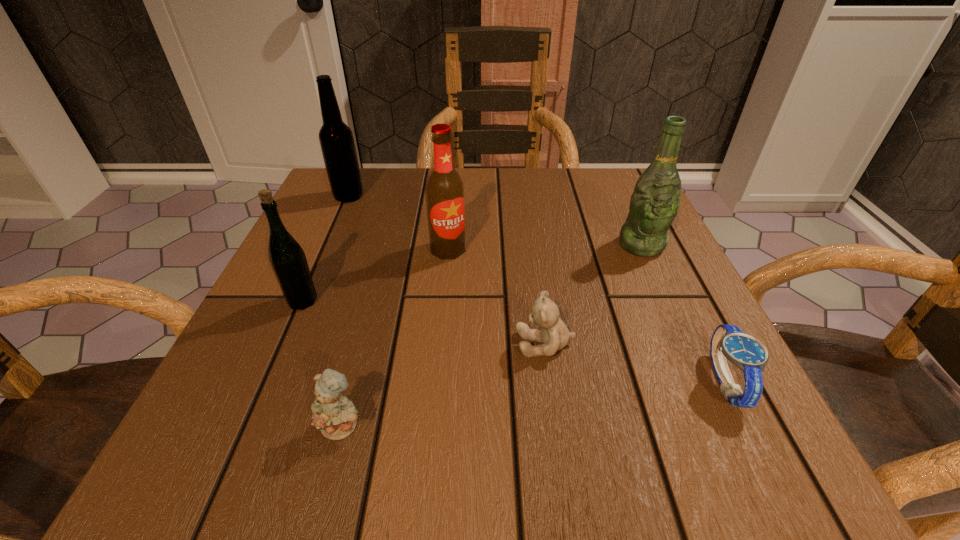
Locate an element on the screen. This screenshot has width=960, height=540. vacant space located 0.120m on the front of the farthest beer bottle is located at coordinates (331, 236).

Image resolution: width=960 pixels, height=540 pixels. I want to click on blank space located on the surface of the rightmost beer bottle, so click(x=683, y=335).

Identify the location of vacant space located 0.230m on the front of the second beer bottle from right to left. Image resolution: width=960 pixels, height=540 pixels. (438, 357).

Find the location of a particular element. blank area located on the right of the fourth farthest object is located at coordinates (423, 301).

Where is `vacant position located 0.220m on the face of the fifth object from left to right`? The image size is (960, 540). vacant position located 0.220m on the face of the fifth object from left to right is located at coordinates (372, 344).

Identify the location of vacant point located 0.320m on the face of the fifth object from left to right. (306, 344).

You are a GUI agent. You are given a task and a screenshot of the screen. Output one action in this format:
    pyautogui.click(x=<x>, y=<y>)
    Task: Click on the free space located on the face of the fifth object from left to right
    The image size is (960, 540).
    Given the screenshot: What is the action you would take?
    tap(438, 344)

Locate an element on the screen. This screenshot has height=540, width=960. vacant region located on the back of the shortest object is located at coordinates (684, 302).

Identify the location of object present at the far edge. (337, 144).

At what (x,y) coordinates should I click in order to perform the action: click on teddy bear located in the near edge section of the desktop. Please return your answer as a coordinate pair (x, y). The height and width of the screenshot is (540, 960). Looking at the image, I should click on (335, 415).